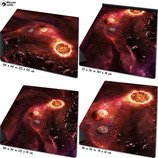
The height and width of the screenshot is (158, 158). Find the location of `picture in bottom right`. picture in bottom right is located at coordinates (147, 104).